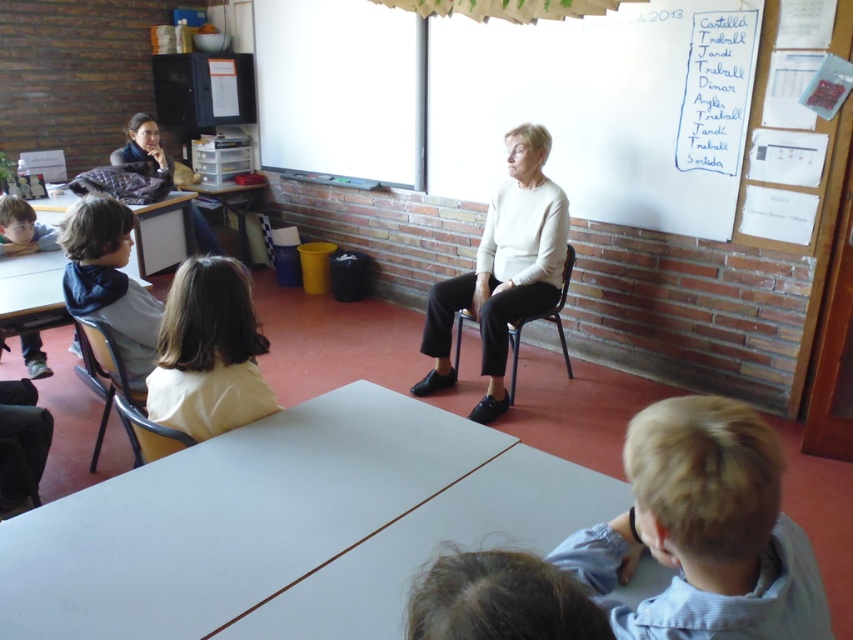
Describe the element at coordinates (438, 545) in the screenshot. I see `white glossy table at lower center` at that location.

Does point (396, 548) come farther from viewer compared to point (577, 636)?

That is True.

Who is more forward, [490,531] or [445,570]?

Point [445,570] is in front.

Where is `white glossy table at lower center`? Image resolution: width=853 pixels, height=640 pixels. white glossy table at lower center is located at coordinates (438, 545).

Can you confirm if blonde hair at lower right is bigger than white matte shirt at center?

Incorrect, blonde hair at lower right is not larger than white matte shirt at center.

Is point (653, 476) less distant than point (561, 211)?

That is True.

Find the location of `blonde hair at lower right`. blonde hair at lower right is located at coordinates (704, 531).

Can you confirm if blonde hair at lower right is shorter than white plastic table at left?

Yes, blonde hair at lower right is shorter than white plastic table at left.

Does point (717, 536) come behind point (155, 230)?

That is False.

Identify the location of blonde hair at lower right. This screenshot has height=640, width=853. (704, 531).